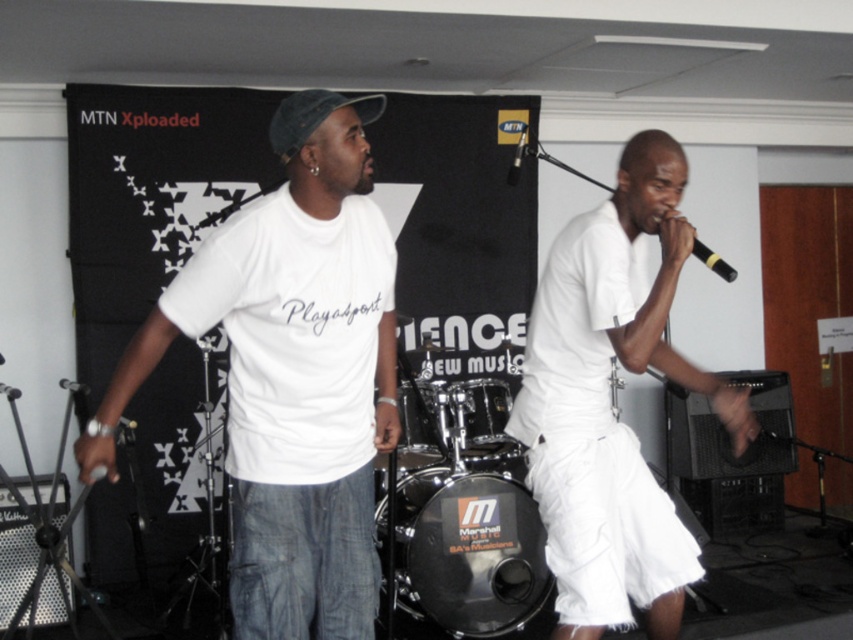
Question: Which is nearer to the black mesh drum at center?

Choices:
 (A) black drum at center
 (B) shiny black drum at center
 (C) black matte microphone at upper right
 (D) white cotton shorts at right

Answer: (A)

Question: Can you confirm if shiny black drum at center is wider than black matte microphone at upper right?

Choices:
 (A) no
 (B) yes

Answer: (A)

Question: Can you confirm if black matte microphone at upper right is positioned to the left of black metallic microphone at upper center?

Choices:
 (A) yes
 (B) no

Answer: (B)

Question: Can you confirm if white cotton t-shirt at center is smaller than black mesh drum at center?

Choices:
 (A) yes
 (B) no

Answer: (B)

Question: Which object is closer to the camera taking this photo?

Choices:
 (A) white cotton shorts at right
 (B) black drum at center
 (C) shiny black drum at center
 (D) black matte microphone at upper right

Answer: (A)

Question: Which point is farther from the camera taking this photo?

Choices:
 (A) (695, 573)
 (B) (416, 440)

Answer: (B)